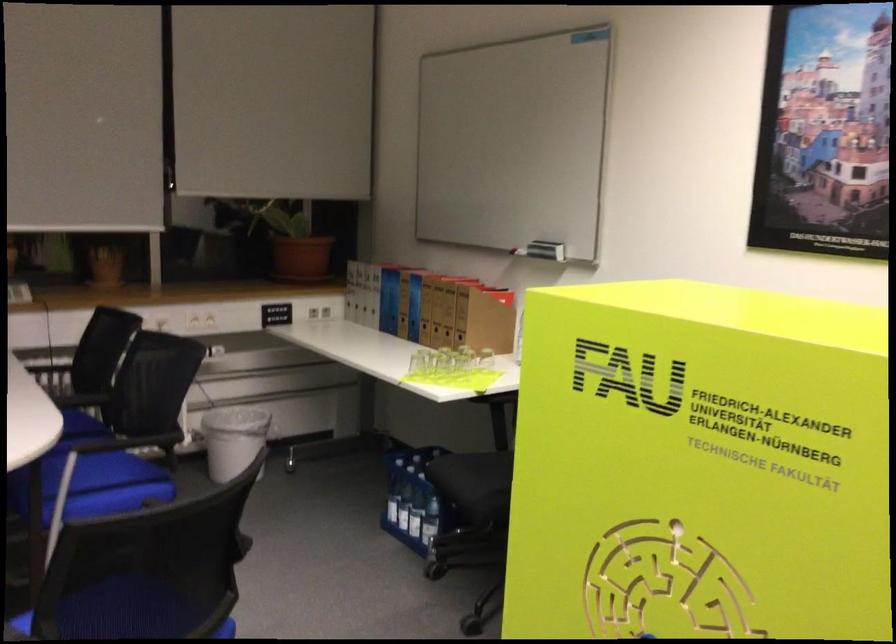
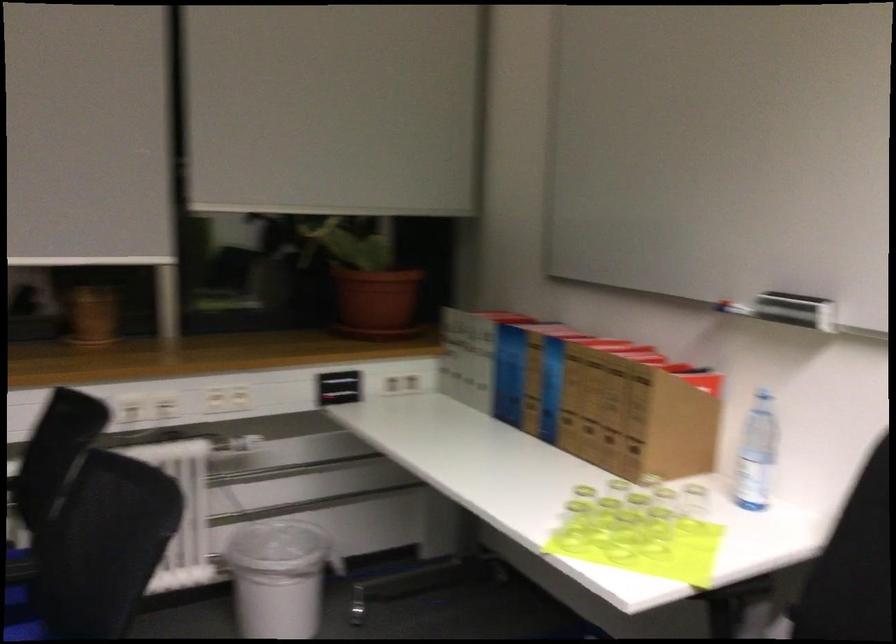
Where in the second image is the point corresponding to the point at 278,315 from the first image?

(339, 386)